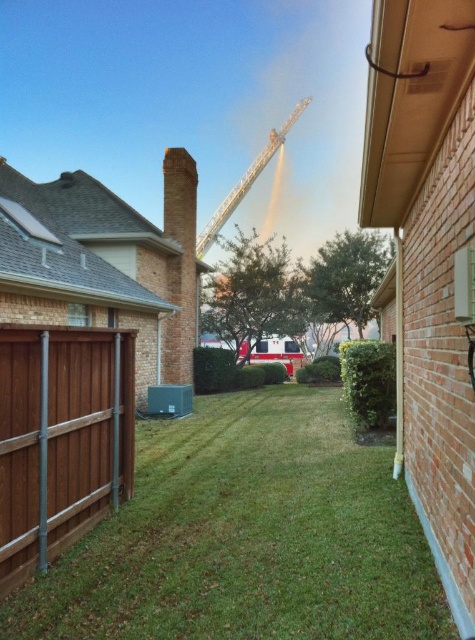
Question: Is brown wood fence at lower left smaller than brick chimney at center?

Choices:
 (A) yes
 (B) no

Answer: (A)

Question: Can you confirm if brick chimney at center is wider than metallic silver crane at upper center?

Choices:
 (A) yes
 (B) no

Answer: (B)

Question: Which object is the farthest from the metallic silver crane at upper center?

Choices:
 (A) brick chimney at center
 (B) brown wood fence at lower left
 (C) green grass at center

Answer: (C)

Question: Does brown wood fence at lower left appear on the left side of brick chimney at center?

Choices:
 (A) no
 (B) yes

Answer: (A)

Question: Which of the following is the farthest from the observer?

Choices:
 (A) (180, 305)
 (B) (253, 173)
 (C) (380, 464)
 (D) (102, 509)

Answer: (B)

Question: Which of the following is the closest to the observer?

Choices:
 (A) brick chimney at center
 (B) metallic silver crane at upper center
 (C) brown wood fence at lower left
 (D) green grass at center

Answer: (D)